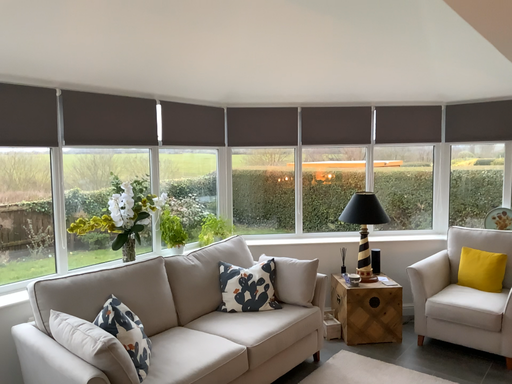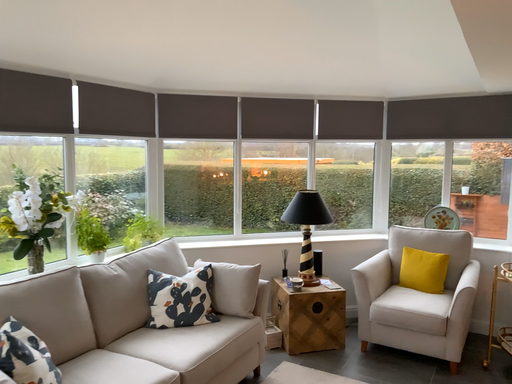
Question: Which way did the camera rotate in the video?

Choices:
 (A) rotated right
 (B) rotated left

Answer: (A)